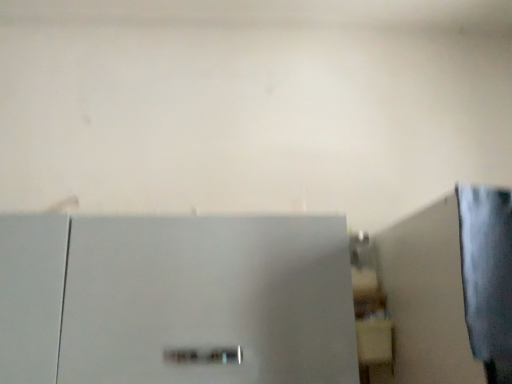
What do you see at coordinates (369, 308) in the screenshot? The width and height of the screenshot is (512, 384). I see `matte white shelf at center-right` at bounding box center [369, 308].

This screenshot has height=384, width=512. What are the coordinates of `matte white shelf at center-right` in the screenshot? It's located at (369, 308).

Locate an element on the screen. The width and height of the screenshot is (512, 384). satin silver refrigerator at center is located at coordinates (176, 300).

The height and width of the screenshot is (384, 512). What do you see at coordinates (176, 300) in the screenshot? I see `satin silver refrigerator at center` at bounding box center [176, 300].

Where is `matte white shelf at center-right`? The width and height of the screenshot is (512, 384). matte white shelf at center-right is located at coordinates (369, 308).

Can you confirm if matte white shelf at center-right is positioned to the left of satin silver refrigerator at center?

Incorrect, matte white shelf at center-right is not on the left side of satin silver refrigerator at center.

Who is more distant, matte white shelf at center-right or satin silver refrigerator at center?

Positioned behind is matte white shelf at center-right.

Does point (360, 329) come farther from viewer compared to point (229, 250)?

Yes, it is behind point (229, 250).

From the image's perspective, is matte white shelf at center-right above or below satin silver refrigerator at center?

Clearly, from the image's perspective, matte white shelf at center-right is above satin silver refrigerator at center.

From a real-world perspective, between matte white shelf at center-right and satin silver refrigerator at center, who is vertically lower?

From a 3D spatial view, satin silver refrigerator at center is below.

Between matte white shelf at center-right and satin silver refrigerator at center, which one has smaller width?

With smaller width is matte white shelf at center-right.

Is matte white shelf at center-right shorter than satin silver refrigerator at center?

Indeed, matte white shelf at center-right has a lesser height compared to satin silver refrigerator at center.

Is matte white shelf at center-right bigger or smaller than satin silver refrigerator at center?

matte white shelf at center-right is smaller than satin silver refrigerator at center.

Is satin silver refrigerator at center a part of matte white shelf at center-right?

No, matte white shelf at center-right does not contain satin silver refrigerator at center.

Is matte white shelf at center-right positioned far away from satin silver refrigerator at center?

No, matte white shelf at center-right is not far away from satin silver refrigerator at center.

Is matte white shelf at center-right looking in the opposite direction of satin silver refrigerator at center?

No, matte white shelf at center-right's orientation is not away from satin silver refrigerator at center.

Can you tell me how much matte white shelf at center-right and satin silver refrigerator at center differ in facing direction?

0.108 degrees separate the facing orientations of matte white shelf at center-right and satin silver refrigerator at center.

Identify the location of refrigerator in front of the matte white shelf at center-right. (176, 300).

Is satin silver refrigerator at center to the right of matte white shelf at center-right from the viewer's perspective?

In fact, satin silver refrigerator at center is to the left of matte white shelf at center-right.

Considering the relative positions of satin silver refrigerator at center and matte white shelf at center-right in the image provided, is satin silver refrigerator at center in front of matte white shelf at center-right?

Yes, it is in front of matte white shelf at center-right.

Does point (106, 351) appear closer or farther from the camera than point (374, 326)?

Clearly, point (106, 351) is closer to the camera than point (374, 326).

From the image's perspective, which one is positioned lower, satin silver refrigerator at center or matte white shelf at center-right?

satin silver refrigerator at center, from the image's perspective.

From the picture: From a real-world perspective, which is physically above, satin silver refrigerator at center or matte white shelf at center-right?

matte white shelf at center-right is physically above.

Considering the relative sizes of satin silver refrigerator at center and matte white shelf at center-right in the image provided, is satin silver refrigerator at center wider than matte white shelf at center-right?

Yes.

In terms of height, does satin silver refrigerator at center look taller or shorter compared to matte white shelf at center-right?

Clearly, satin silver refrigerator at center is taller compared to matte white shelf at center-right.

Does satin silver refrigerator at center have a larger size compared to matte white shelf at center-right?

Correct, satin silver refrigerator at center is larger in size than matte white shelf at center-right.

Is satin silver refrigerator at center spatially inside matte white shelf at center-right, or outside of it?

satin silver refrigerator at center cannot be found inside matte white shelf at center-right.

Is satin silver refrigerator at center far from matte white shelf at center-right?

No, satin silver refrigerator at center is not far away from matte white shelf at center-right.

Is satin silver refrigerator at center turned away from matte white shelf at center-right?

satin silver refrigerator at center is not turned away from matte white shelf at center-right.

How different are the orientations of satin silver refrigerator at center and matte white shelf at center-right in degrees?

They differ by 0.108 degrees in their facing directions.

The width and height of the screenshot is (512, 384). In order to click on refrigerator in front of the matte white shelf at center-right in this screenshot , I will do `click(176, 300)`.

Identify the location of shelf above the satin silver refrigerator at center (from the image's perspective). (369, 308).

The height and width of the screenshot is (384, 512). Find the location of `shelf on the right of satin silver refrigerator at center`. shelf on the right of satin silver refrigerator at center is located at coordinates 369,308.